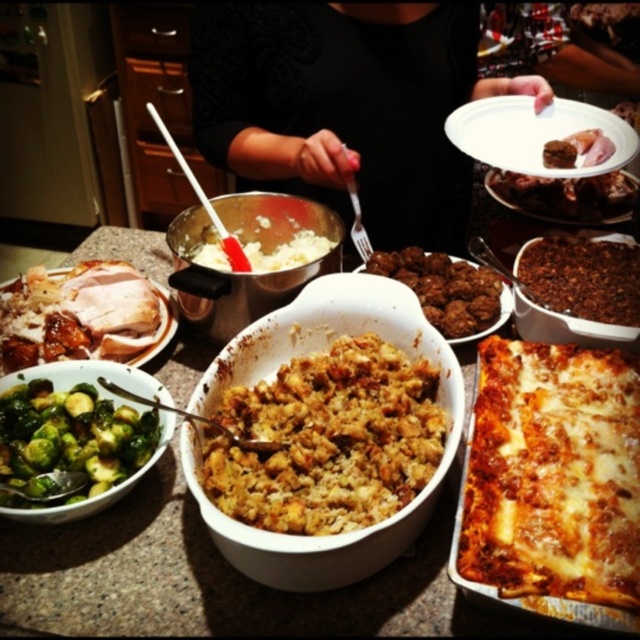
Which is more to the right, dark chocolate cake at center or brown crispy meat at center?

brown crispy meat at center is more to the right.

Does point (532, 284) lie in front of point (566, 188)?

Yes, point (532, 284) is closer to viewer.

The width and height of the screenshot is (640, 640). Identify the location of dark chocolate cake at center. (582, 276).

Image resolution: width=640 pixels, height=640 pixels. What are the coordinates of `dark chocolate cake at center` in the screenshot? It's located at (582, 276).

Is golden brown roasted turkey at left taller than brown crispy meat at center?

Yes.

Between golden brown roasted turkey at left and brown crispy meat at center, which one has less height?

brown crispy meat at center is shorter.

Who is more forward, (109, 352) or (496, 186)?

Point (109, 352) is more forward.

This screenshot has width=640, height=640. In order to click on golden brown roasted turkey at left in this screenshot , I will do `click(77, 314)`.

Is green matte brussels sprouts at lower left below brown crispy skin at center?

Correct, green matte brussels sprouts at lower left is located below brown crispy skin at center.

Between point (38, 480) and point (564, 144), which one is positioned in front?

Point (38, 480) is more forward.

Is point (76, 445) positioned after point (593, 136)?

No, (76, 445) is in front of (593, 136).

This screenshot has height=640, width=640. What are the coordinates of `green matte brussels sprouts at lower left` in the screenshot? It's located at (67, 442).